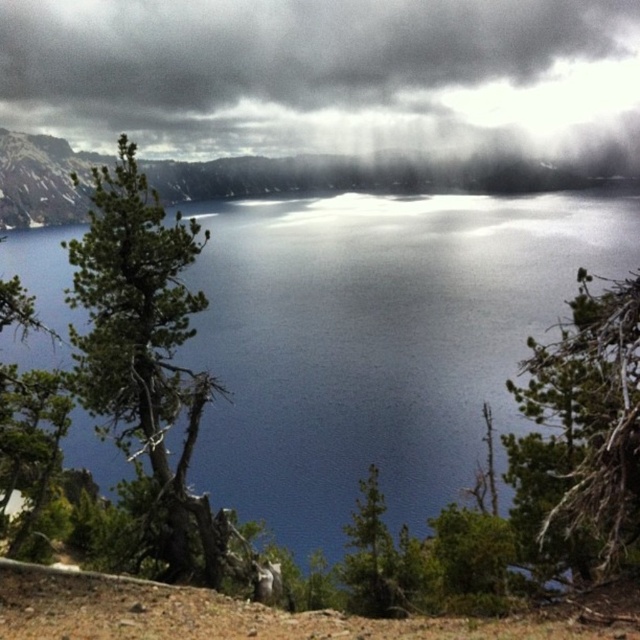
Is dark gray cloud at upper center bigger than green matte tree at center?

Indeed, dark gray cloud at upper center has a larger size compared to green matte tree at center.

Describe the element at coordinates (314, 60) in the screenshot. Image resolution: width=640 pixels, height=640 pixels. I see `dark gray cloud at upper center` at that location.

This screenshot has height=640, width=640. What do you see at coordinates (314, 60) in the screenshot?
I see `dark gray cloud at upper center` at bounding box center [314, 60].

What are the coordinates of `dark gray cloud at upper center` in the screenshot? It's located at [x=314, y=60].

Can you confirm if green textured tree at left is positioned below green needle-like foliage at center?

Yes.

Does green textured tree at left have a lesser height compared to green needle-like foliage at center?

Incorrect, green textured tree at left's height does not fall short of green needle-like foliage at center's.

Who is more distant from viewer, (112, 193) or (614, 500)?

The point (112, 193) is behind.

You are a GUI agent. You are given a task and a screenshot of the screen. Output one action in this format:
    pyautogui.click(x=<x>, y=<y>)
    Task: Click on the green textured tree at left
    This screenshot has height=640, width=640.
    Given the screenshot: What is the action you would take?
    pyautogui.click(x=145, y=349)

Is blue reflective water at center above green needle-like foliage at center?

Indeed, blue reflective water at center is positioned over green needle-like foliage at center.

Does blue reflective water at center have a smaller size compared to green needle-like foliage at center?

Incorrect, blue reflective water at center is not smaller in size than green needle-like foliage at center.

This screenshot has width=640, height=640. In order to click on blue reflective water at center in this screenshot , I will do `click(378, 340)`.

Find the location of a particular element. blue reflective water at center is located at coordinates (378, 340).